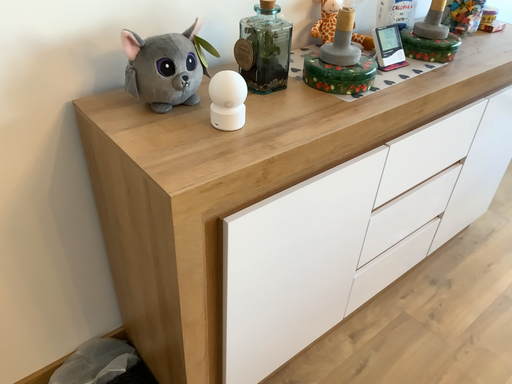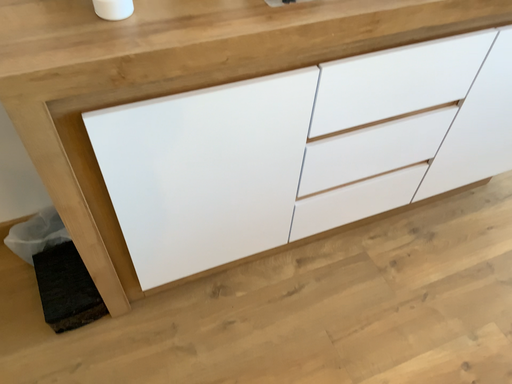
Question: Which way did the camera rotate in the video?

Choices:
 (A) rotated downward
 (B) rotated upward

Answer: (A)